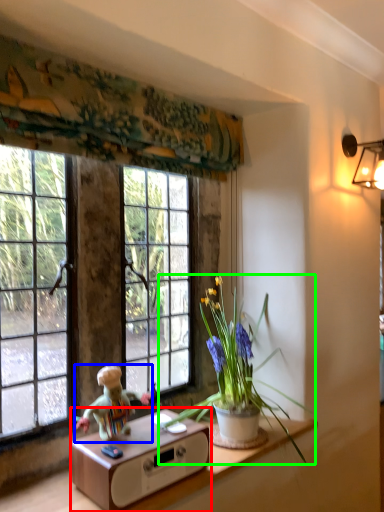
Question: Considering the real-world distances, which object is closest to table (highlighted by a red box)? person (highlighted by a blue box) or houseplant (highlighted by a green box).

Choices:
 (A) person
 (B) houseplant

Answer: (A)